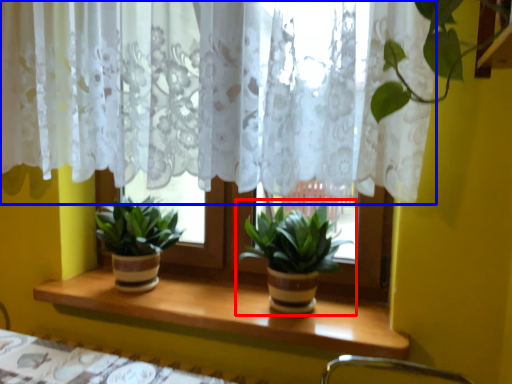
Question: Among these objects, which one is nearest to the camera, houseplant (highlighted by a red box) or curtain (highlighted by a blue box)?

Choices:
 (A) houseplant
 (B) curtain

Answer: (B)